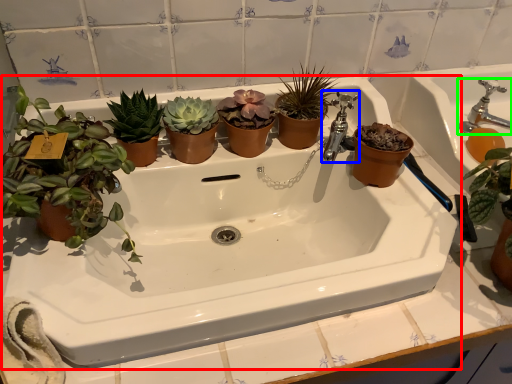
Question: Which is nearer to the sink (highlighted by a red box)? tap (highlighted by a blue box) or tap (highlighted by a green box).

Choices:
 (A) tap
 (B) tap

Answer: (A)